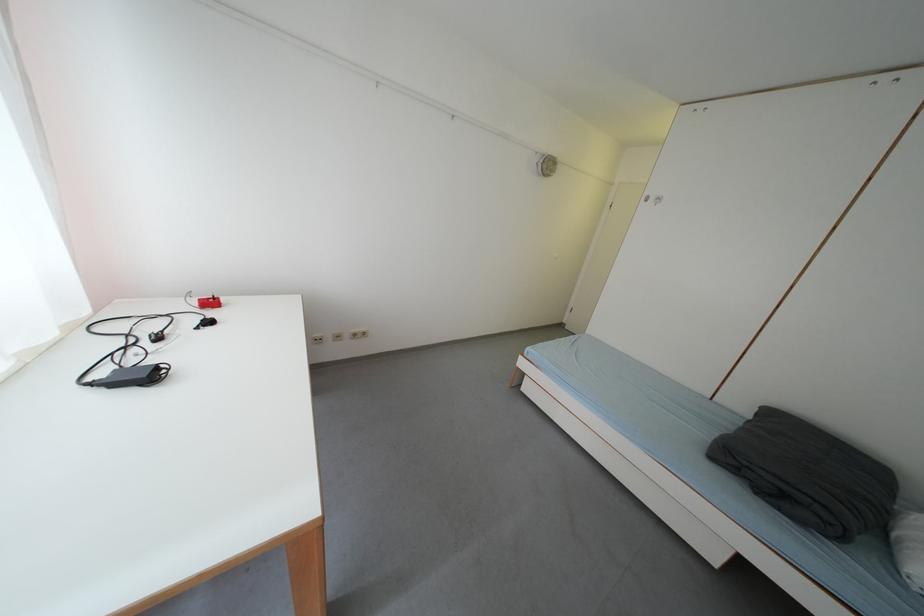
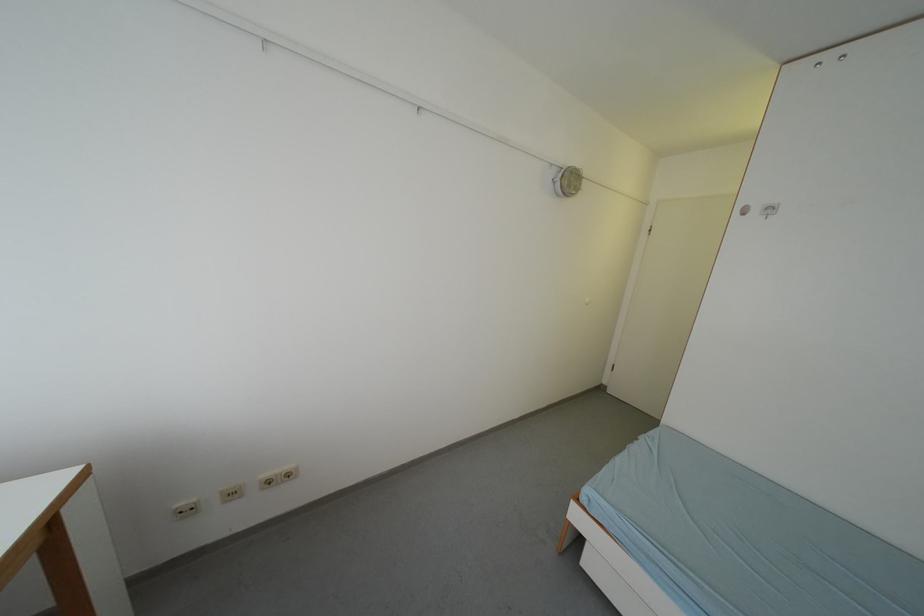
The point at (342, 338) is marked in the first image. Where is the corresponding point in the second image?

(229, 496)